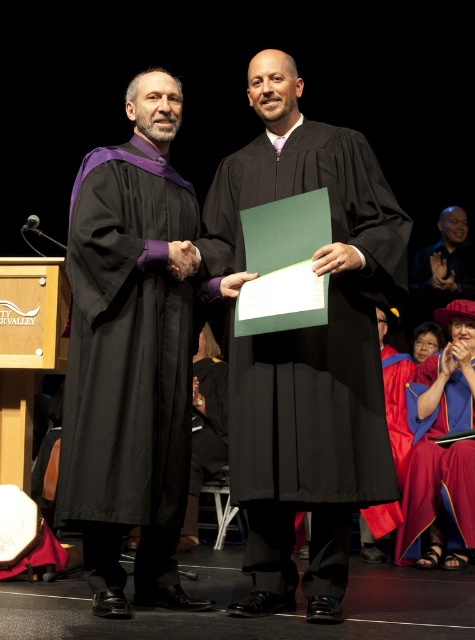
You are attending a graduation ceremony and see two graduates in the scene. One is wearing a matte black gown at center and the other a velvet maroon gown at lower right. Which graduate is standing taller?

The matte black gown at center is much taller than the velvet maroon gown at lower right, so the graduate in the matte black gown at center is standing taller.

You are a photographer standing at the camera position. You want to take a closeup photo of the black matte graduation gown at center. Is the gown within your camera range of 10 feet?

The black matte graduation gown at center is 9.07 feet from camera, so yes, it is within the camera range of 10 feet.

What is located at the coordinates point (443, 266) in the image?

The bald head at center is located at point (443, 266).